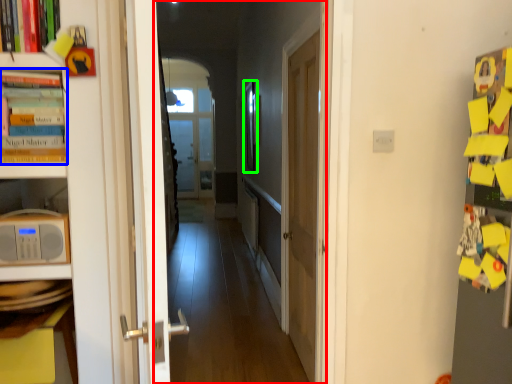
Question: Estimate the real-world distances between objects in this image. Which object is closer to corridor (highlighted by a red box), book (highlighted by a blue box) or picture frame (highlighted by a green box)?

Choices:
 (A) book
 (B) picture frame

Answer: (B)